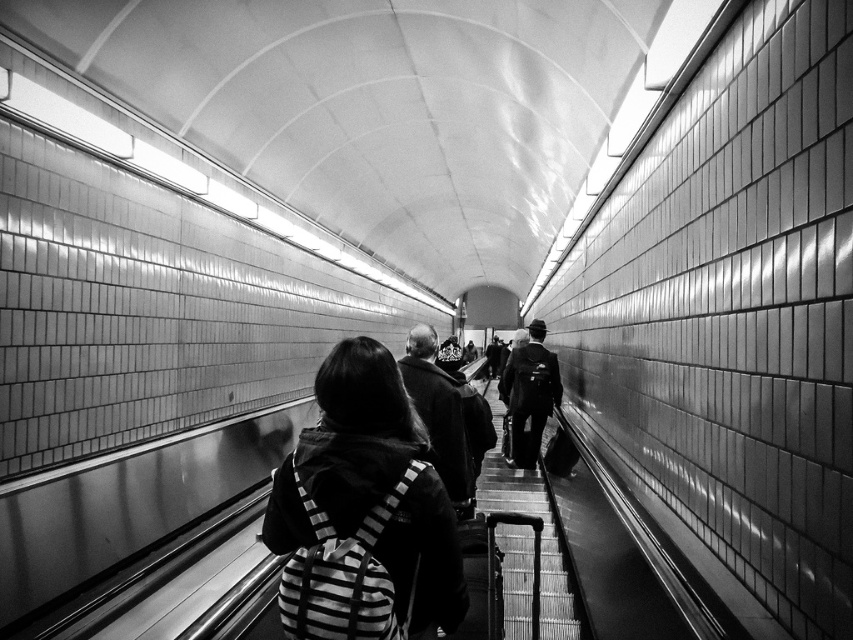
Question: Is dark wool coat at center bigger than dark gray suit at center?

Choices:
 (A) no
 (B) yes

Answer: (B)

Question: Considering the real-world distances, which object is closest to the dark gray suit at center?

Choices:
 (A) dark wool coat at center
 (B) striped fabric backpack at center

Answer: (A)

Question: Does dark wool coat at center have a smaller size compared to dark gray suit at center?

Choices:
 (A) no
 (B) yes

Answer: (A)

Question: Which of the following is the farthest from the observer?

Choices:
 (A) striped fabric backpack at center
 (B) dark wool coat at center

Answer: (B)

Question: Which object appears closest to the camera in this image?

Choices:
 (A) dark gray suit at center
 (B) striped fabric backpack at center

Answer: (B)

Question: Is striped fabric backpack at center below dark wool coat at center?

Choices:
 (A) no
 (B) yes

Answer: (A)